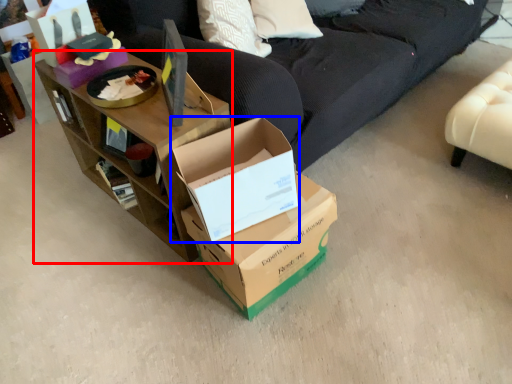
Question: Which object is further to the camera taking this photo, shelf (highlighted by a red box) or box (highlighted by a blue box)?

Choices:
 (A) shelf
 (B) box

Answer: (A)